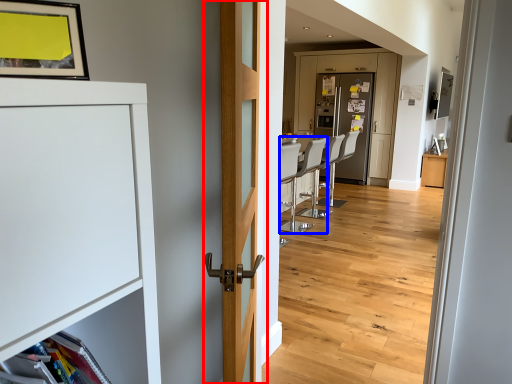
Question: Which object is further to the camera taking this photo, door (highlighted by a red box) or armchair (highlighted by a blue box)?

Choices:
 (A) door
 (B) armchair

Answer: (B)